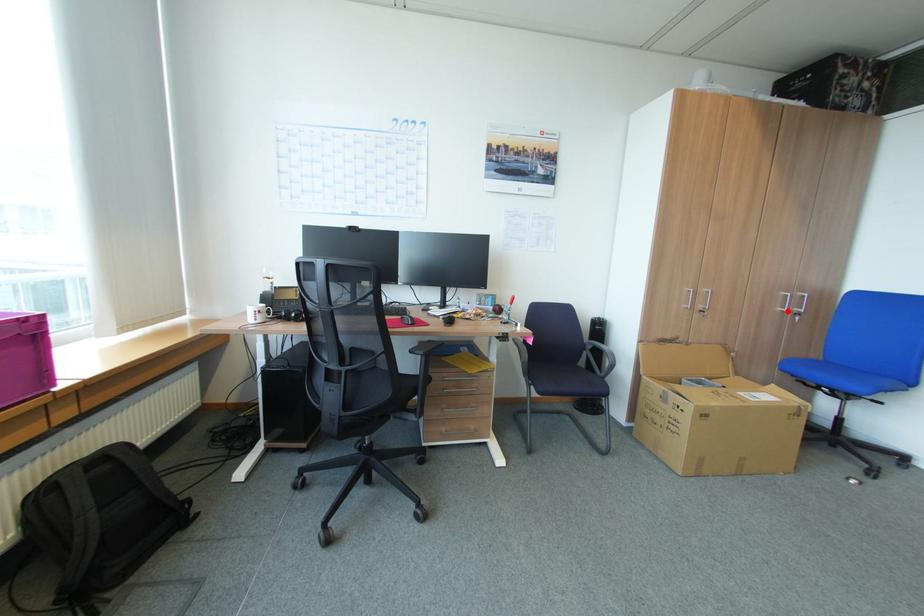
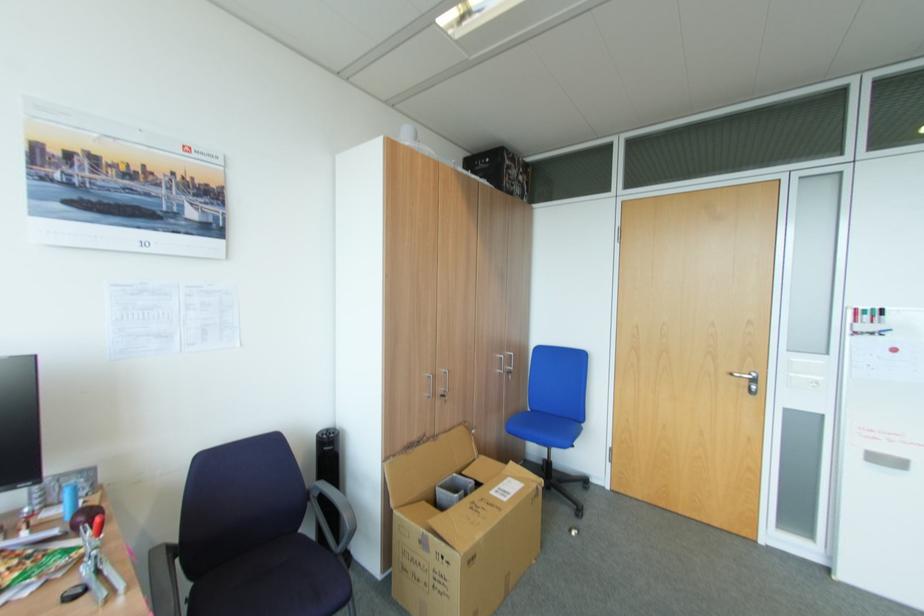
The point at the highlighted location is marked in the first image. Where is the corresponding point in the second image?

(505, 371)